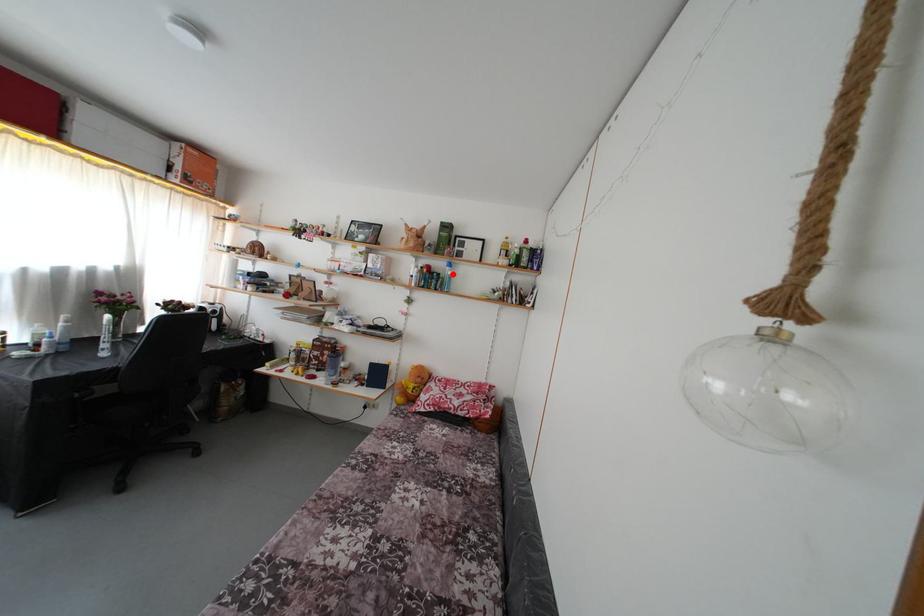
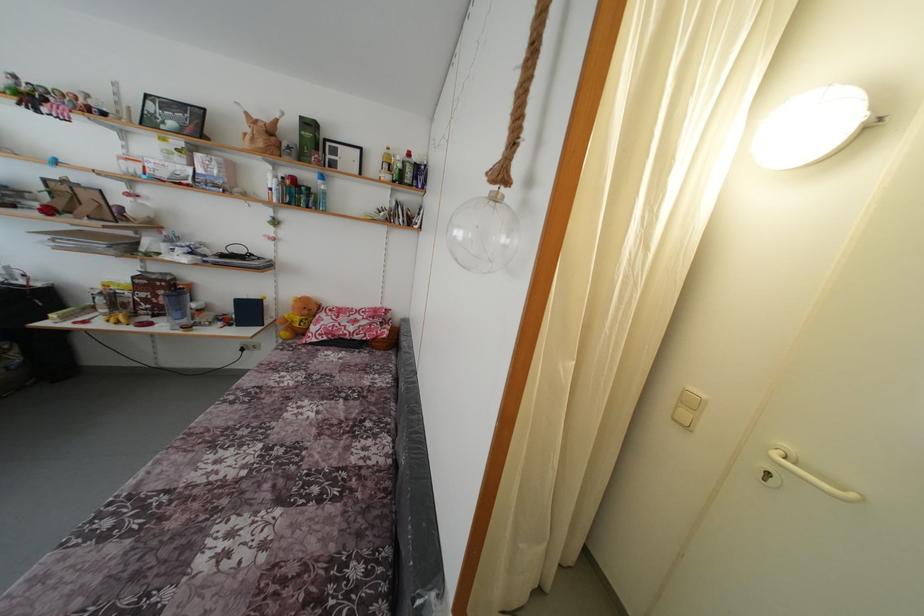
The point at the highlighted location is marked in the first image. Where is the corresponding point in the second image?

(324, 188)